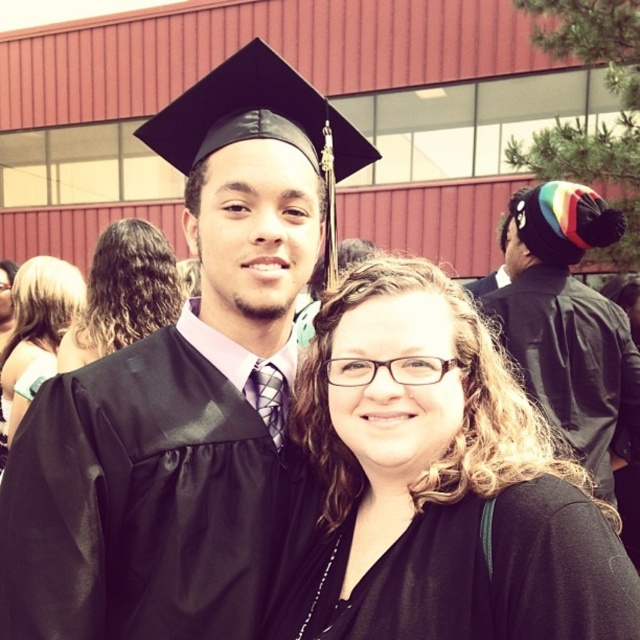
You are a photographer at the graduation ceremony. You need to adjust the camera focus so that both the satin black graduation gown at center and the blonde hair at center are in focus. Since the graduation gown is taller than the blonde hair, which object should you focus on first to ensure both are in focus?

The satin black graduation gown at center is taller than the blonde hair at center. To ensure both are in focus, you should focus on the satin black graduation gown at center first, as it is the taller object and will require adjusting the focus to cover the depth between them.

You are a photographer at a graduation ceremony. You need to capture a photo of the two subjects, the satin black graduation gown at center and the blonde hair at center. Based on their positions, which subject is located to the left of the other?

The blonde hair at center is located to the left of the satin black graduation gown at center because the gown is on the right side of the blonde hair.